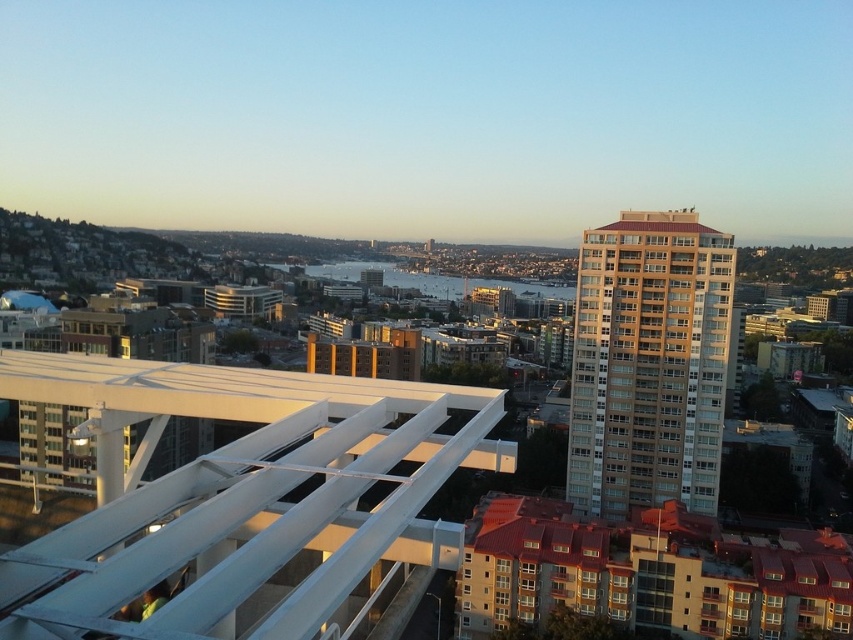
Is white metallic rail at center taller than beige concrete building at right?

No, white metallic rail at center is not taller than beige concrete building at right.

Consider the image. Which of these two, white metallic rail at center or beige concrete building at right, stands shorter?

Standing shorter between the two is white metallic rail at center.

Describe the element at coordinates (239, 490) in the screenshot. This screenshot has width=853, height=640. I see `white metallic rail at center` at that location.

Identify the location of white metallic rail at center. This screenshot has width=853, height=640. (239, 490).